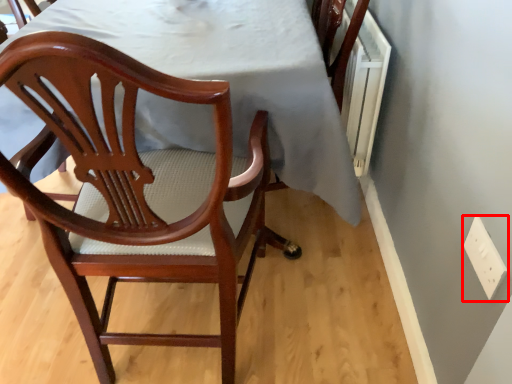
Question: From the image, what is the correct spatial relationship of electric outlet (annotated by the red box) in relation to chair?

Choices:
 (A) right
 (B) left

Answer: (A)